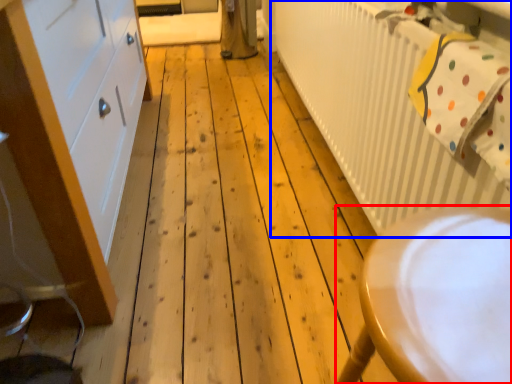
Question: Which point is further to the camera, furniture (highlighted by a red box) or radiator (highlighted by a blue box)?

Choices:
 (A) furniture
 (B) radiator

Answer: (B)